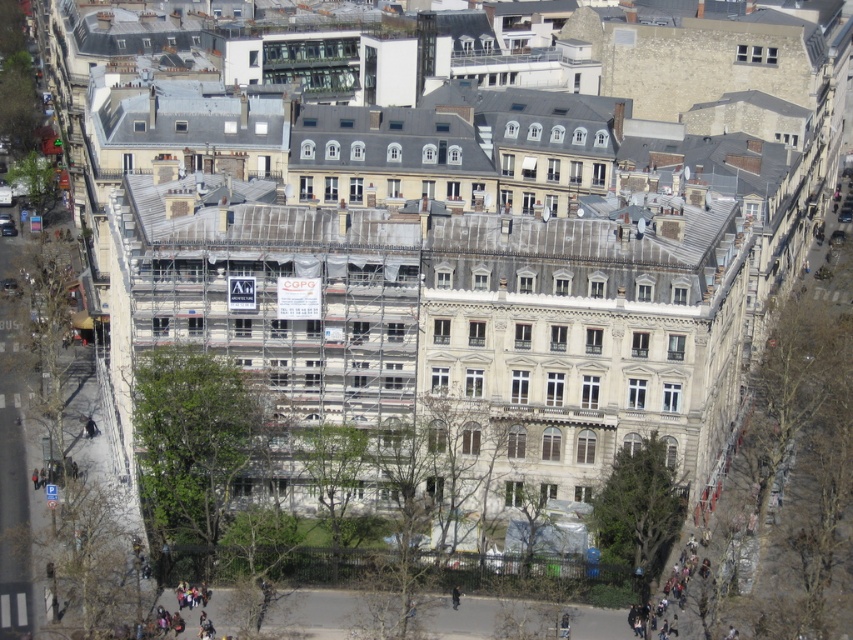
Question: In this image, where is dark gray concrete stairs at lower right located relative to dark gray jacket at center?

Choices:
 (A) above
 (B) below

Answer: (A)

Question: Which object is closer to the camera taking this photo?

Choices:
 (A) dark gray jacket at center
 (B) dark gray concrete stairs at lower right

Answer: (B)

Question: Can you confirm if dark gray concrete stairs at lower right is bigger than dark gray jacket at center?

Choices:
 (A) no
 (B) yes

Answer: (B)

Question: Is dark gray concrete stairs at lower right thinner than dark gray jacket at center?

Choices:
 (A) no
 (B) yes

Answer: (A)

Question: Which point is farther to the camera?

Choices:
 (A) (457, 595)
 (B) (688, 548)

Answer: (B)